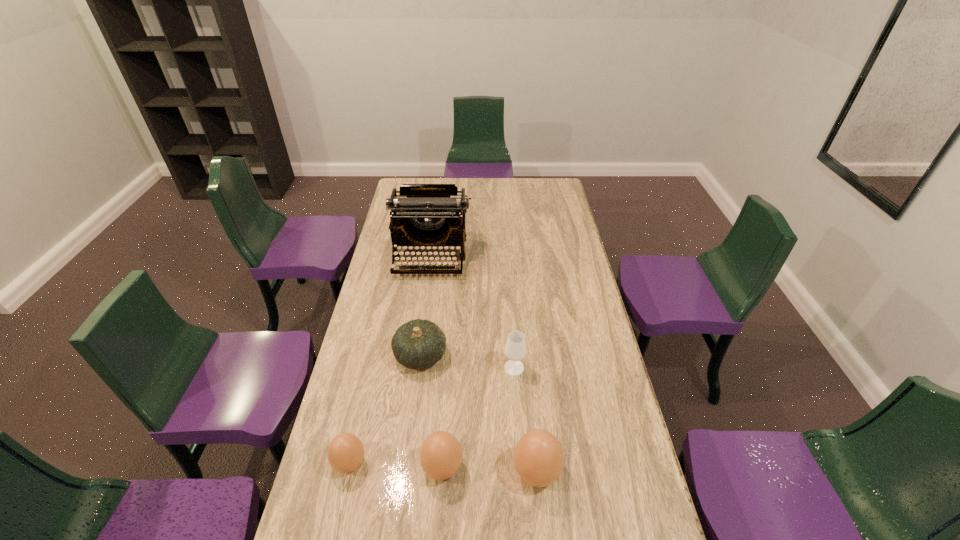
You are a GUI agent. You are given a task and a screenshot of the screen. Output one action in this format:
    pyautogui.click(x=<x>, y=<y>)
    Task: Click on the closest boiled egg to the second boiled egg from right to left
    The width and height of the screenshot is (960, 540).
    Given the screenshot: What is the action you would take?
    pyautogui.click(x=538, y=457)

This screenshot has width=960, height=540. I want to click on boiled egg object that ranks as the second closest to the leftmost boiled egg, so click(x=538, y=457).

Image resolution: width=960 pixels, height=540 pixels. Identify the location of vacant space that satisfies the following two spatial constraints: 1. on the typing side of the gourd; 2. on the right side of the farthest object. 417,355.

You are a GUI agent. You are given a task and a screenshot of the screen. Output one action in this format:
    pyautogui.click(x=<x>, y=<y>)
    Task: Click on the free point that satisfies the following two spatial constraints: 1. on the back side of the leftmost boiled egg; 2. on the right side of the gourd
    Image resolution: width=960 pixels, height=540 pixels.
    Given the screenshot: What is the action you would take?
    pyautogui.click(x=374, y=355)

Locate an element on the screen. The image size is (960, 540). vacant area in the image that satisfies the following two spatial constraints: 1. on the typing side of the second boiled egg from left to right; 2. on the left side of the farthest object is located at coordinates (402, 468).